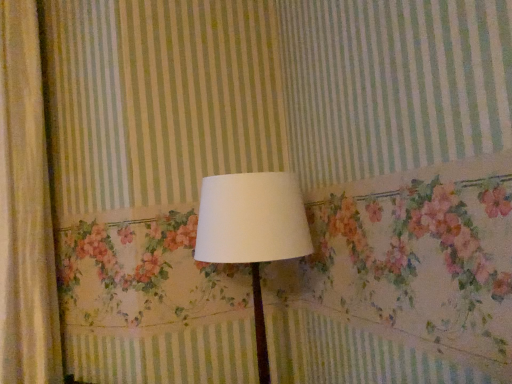
Locate an element on the screen. The image size is (512, 384). white matte lampshade at center is located at coordinates (252, 231).

Image resolution: width=512 pixels, height=384 pixels. Describe the element at coordinates (252, 231) in the screenshot. I see `white matte lampshade at center` at that location.

The height and width of the screenshot is (384, 512). In order to click on white matte lampshade at center in this screenshot , I will do `click(252, 231)`.